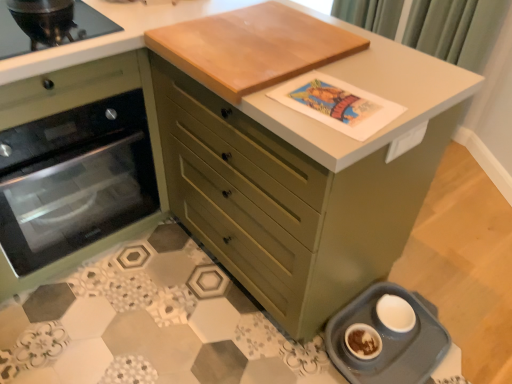
Identify the location of vacant region above matte green chest of drawers at center (from a real-world perspective). The height and width of the screenshot is (384, 512). (249, 31).